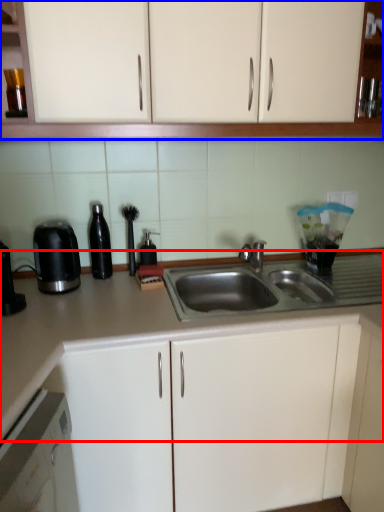
Question: Which object is closer to the camera taking this photo, countertop (highlighted by a red box) or cabinetry (highlighted by a blue box)?

Choices:
 (A) countertop
 (B) cabinetry

Answer: (B)